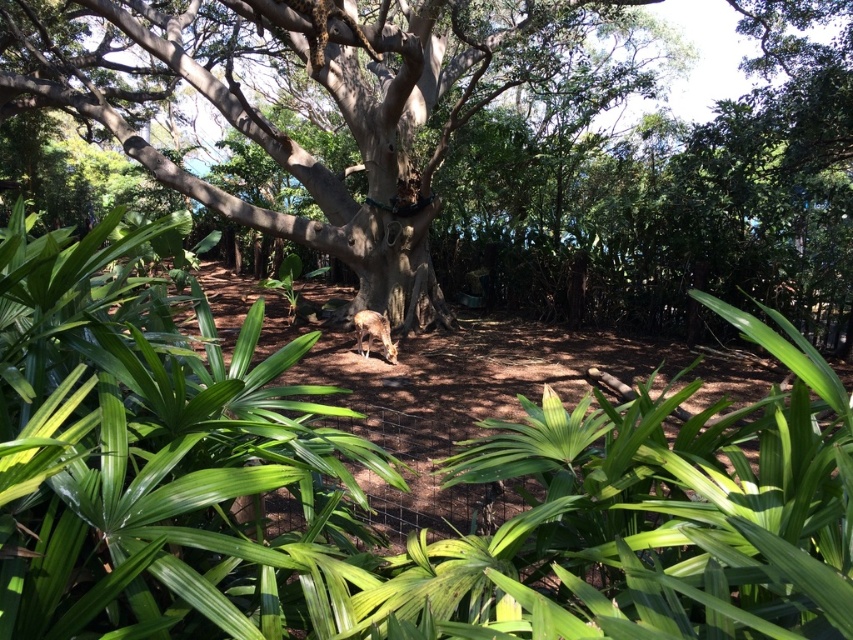
Question: Observing the image, what is the correct spatial positioning of green leafy plant at center in reference to fur-like brown animal at center?

Choices:
 (A) above
 (B) below

Answer: (B)

Question: Which point is closer to the camera?

Choices:
 (A) (357, 314)
 (B) (701, 506)

Answer: (B)

Question: Which is farther from the green leafy plant at center?

Choices:
 (A) fur-like brown animal at center
 (B) smooth bark tree at center

Answer: (B)

Question: Which point is closer to the camera?

Choices:
 (A) smooth bark tree at center
 (B) fur-like brown animal at center
 (C) green leafy plant at center

Answer: (C)

Question: Observing the image, what is the correct spatial positioning of green leafy plant at center in reference to smooth bark tree at center?

Choices:
 (A) below
 (B) above

Answer: (A)

Question: Does green leafy plant at center have a smaller size compared to fur-like brown animal at center?

Choices:
 (A) yes
 (B) no

Answer: (B)